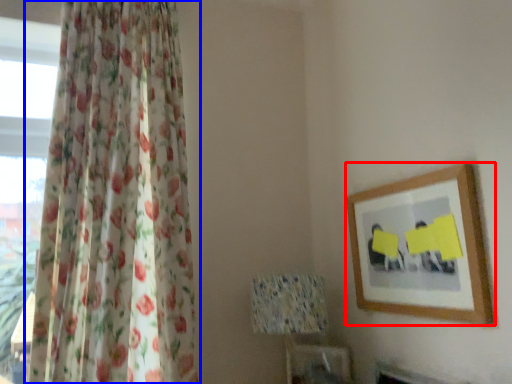
Question: Which point is closer to the camera, picture frame (highlighted by a red box) or curtain (highlighted by a blue box)?

Choices:
 (A) picture frame
 (B) curtain

Answer: (B)